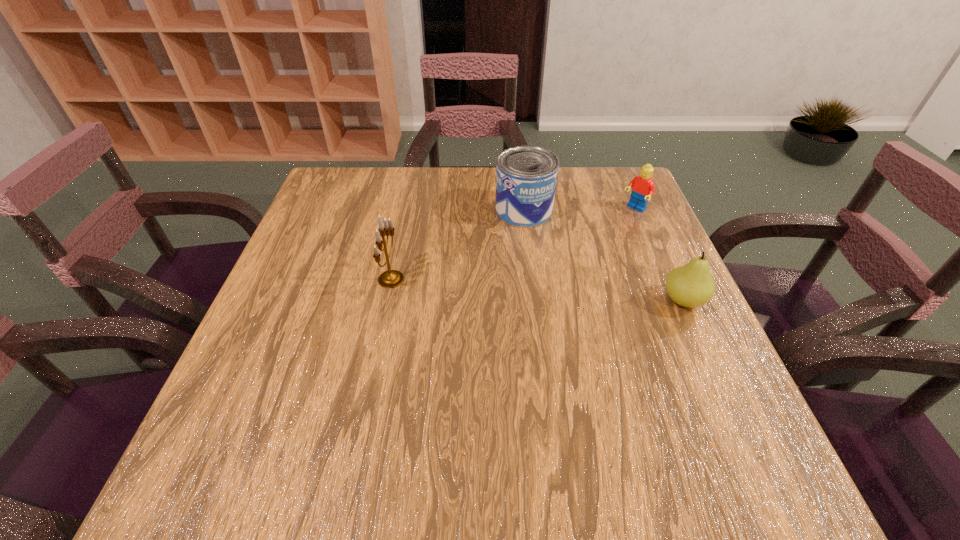
Locate an element on the screen. free space on the desktop that is between the leftmost object and the pear and is positioned on the front label of the second object from left to right is located at coordinates (537, 290).

At what (x,y) coordinates should I click in order to perform the action: click on vacant space on the desktop that is between the candelabrum and the pear and is positioned on the face of the Lego. Please return your answer as a coordinate pair (x, y). Looking at the image, I should click on (540, 290).